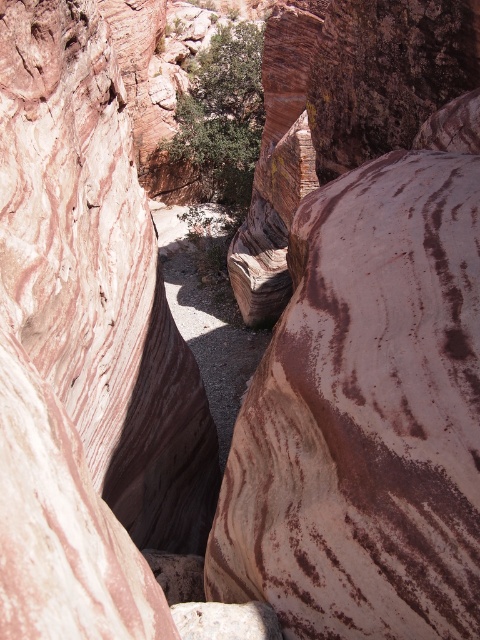
Question: Is green leafy bush at center to the right of white marble rock at center from the viewer's perspective?

Choices:
 (A) yes
 (B) no

Answer: (B)

Question: Which of the following is the closest to the observer?

Choices:
 (A) (263, 628)
 (B) (228, 28)

Answer: (A)

Question: Which point is farther to the camera?

Choices:
 (A) (227, 42)
 (B) (223, 637)

Answer: (A)

Question: Is green leafy bush at center thinner than white marble rock at center?

Choices:
 (A) no
 (B) yes

Answer: (A)

Question: Does green leafy bush at center appear over white marble rock at center?

Choices:
 (A) no
 (B) yes

Answer: (B)